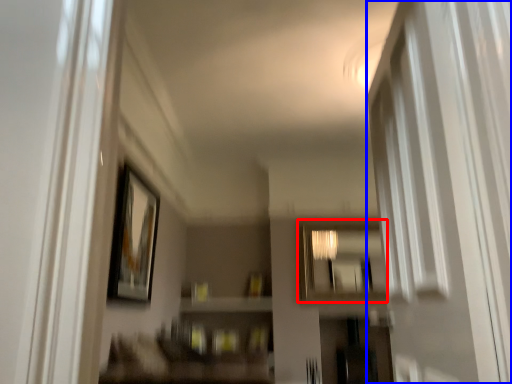
Question: Which object is closer to the camera taking this photo, mirror (highlighted by a red box) or screen door (highlighted by a blue box)?

Choices:
 (A) mirror
 (B) screen door

Answer: (B)